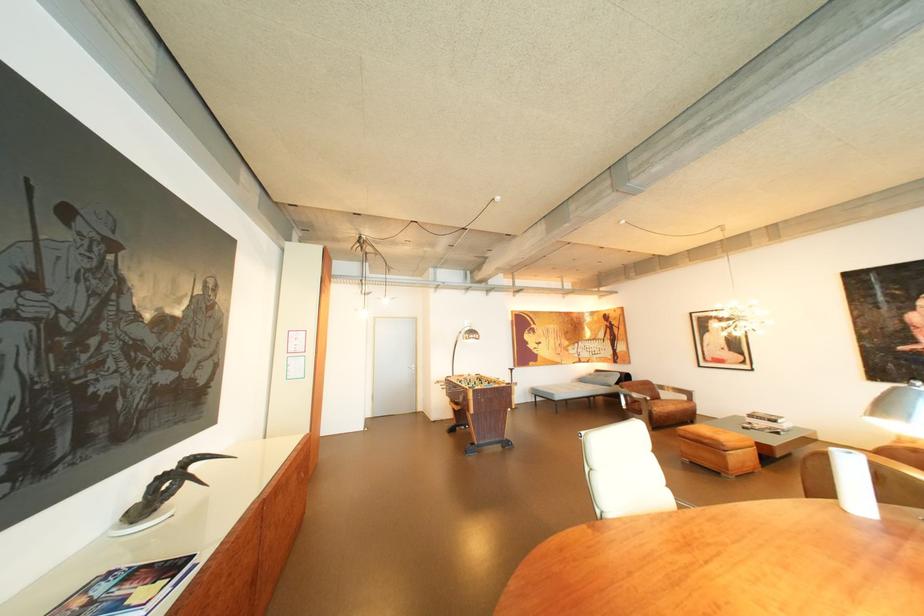
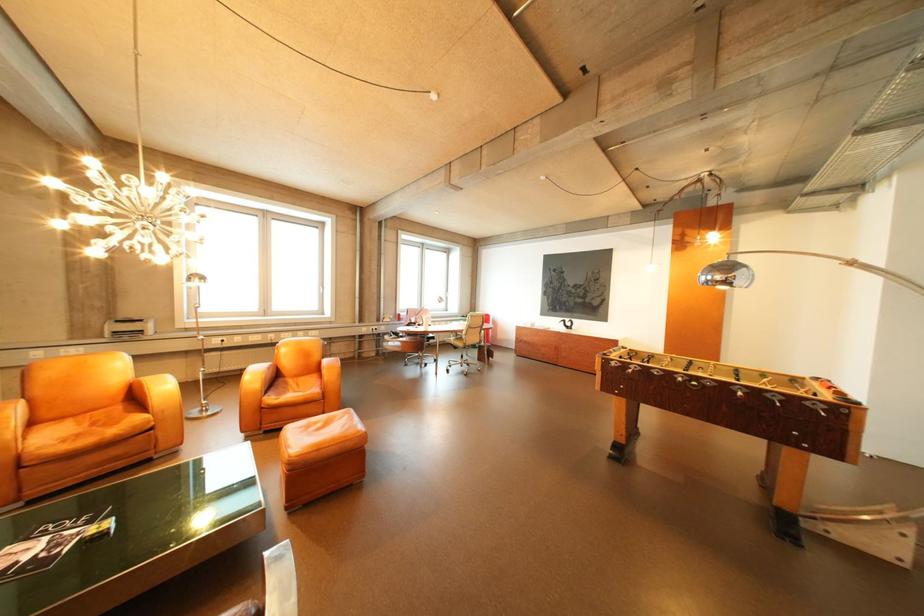
Question: I am providing you with two images of the same scene from different viewpoints. After the viewpoint changes to image2, which objects are now occluded?

Choices:
 (A) silver lamp head
 (B) white rotary switch
 (C) colorful magazine
 (D) orange chair sitting surface

Answer: (C)